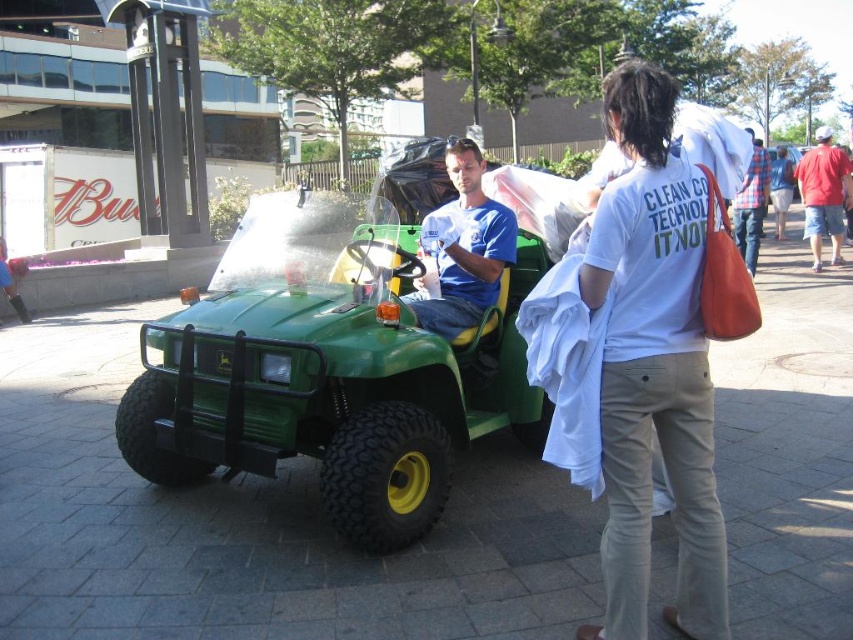
Question: Estimate the real-world distances between objects in this image. Which object is closer to the green matte utility vehicle at center?

Choices:
 (A) denim jacket at lower right
 (B) red cotton shirt at right

Answer: (B)

Question: Which object is positioned farthest from the green matte utility vehicle at center?

Choices:
 (A) red cotton shirt at right
 (B) flannel plaid shirt at right
 (C) denim jacket at lower right
 (D) matte blue shirt at center

Answer: (C)

Question: Which point is farther from the camera taking this photo?

Choices:
 (A) (500, 272)
 (B) (740, 198)
 (C) (788, 166)

Answer: (C)

Question: Is matte blue shirt at center wider than red cotton shirt at right?

Choices:
 (A) yes
 (B) no

Answer: (B)

Question: Is green matte utility vehicle at center to the left of matte blue shirt at center from the viewer's perspective?

Choices:
 (A) no
 (B) yes

Answer: (B)

Question: Is matte blue shirt at center closer to camera compared to red cotton shirt at right?

Choices:
 (A) no
 (B) yes

Answer: (B)